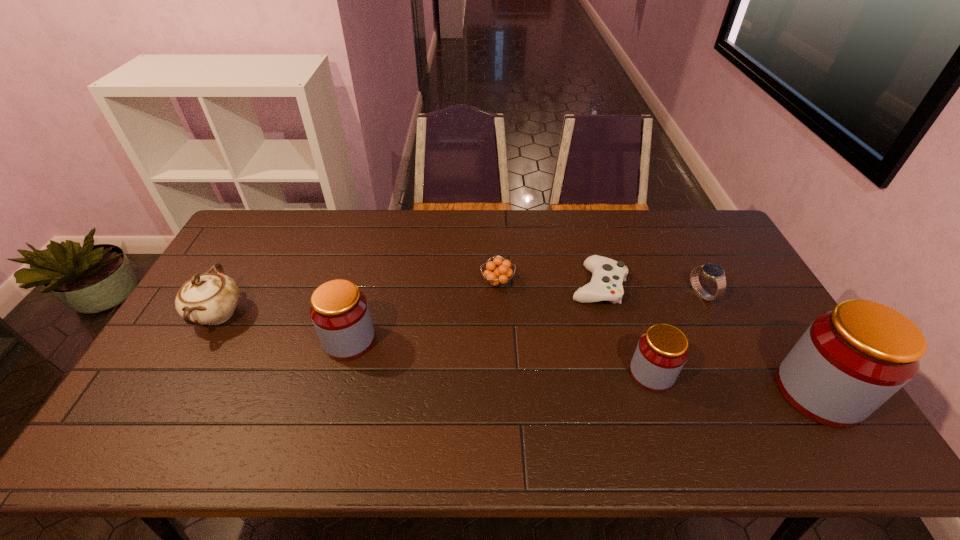
To ensure equal spacing by inserting another jar among them, please point out a vacant spot for this new jar. Please provide its 2D coordinates. Your answer should be formatted as a tuple, i.e. [(x, y)], where the tuple contains the x and y coordinates of a point satisfying the conditions above.

[(495, 356)]